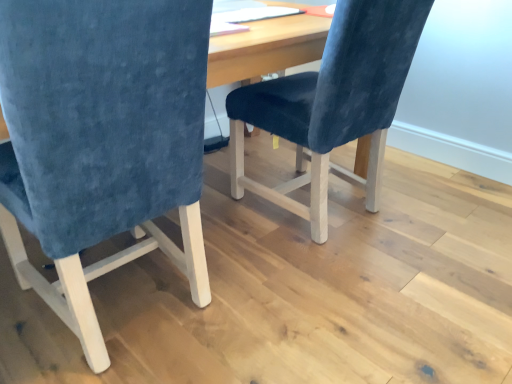
Question: Is point (50, 127) positioned closer to the camera than point (402, 28)?

Choices:
 (A) farther
 (B) closer

Answer: (B)

Question: From a real-world perspective, relative to velvet blue chair at center, which is the 2th chair from left to right, is velvet blue chair at left, which is the 1th chair in left-to-right order, vertically above or below?

Choices:
 (A) below
 (B) above

Answer: (B)

Question: Do you think velvet blue chair at left, which appears as the 2th chair when viewed from the right, is within velvet blue chair at center, which ranks as the first chair in right-to-left order, or outside of it?

Choices:
 (A) inside
 (B) outside

Answer: (B)

Question: From a real-world perspective, relative to velvet blue chair at left, which appears as the 2th chair when viewed from the right, is velvet blue chair at center, which is the 2th chair from left to right, vertically above or below?

Choices:
 (A) above
 (B) below

Answer: (B)

Question: From the image's perspective, is velvet blue chair at center, which ranks as the first chair in right-to-left order, above or below velvet blue chair at left, which appears as the 2th chair when viewed from the right?

Choices:
 (A) above
 (B) below

Answer: (A)

Question: Based on their sizes in the image, would you say velvet blue chair at center, which is the 2th chair from left to right, is bigger or smaller than velvet blue chair at left, which is the 1th chair in left-to-right order?

Choices:
 (A) big
 (B) small

Answer: (B)

Question: Relative to velvet blue chair at left, which appears as the 2th chair when viewed from the right, is velvet blue chair at center, which ranks as the first chair in right-to-left order, in front or behind?

Choices:
 (A) front
 (B) behind

Answer: (B)